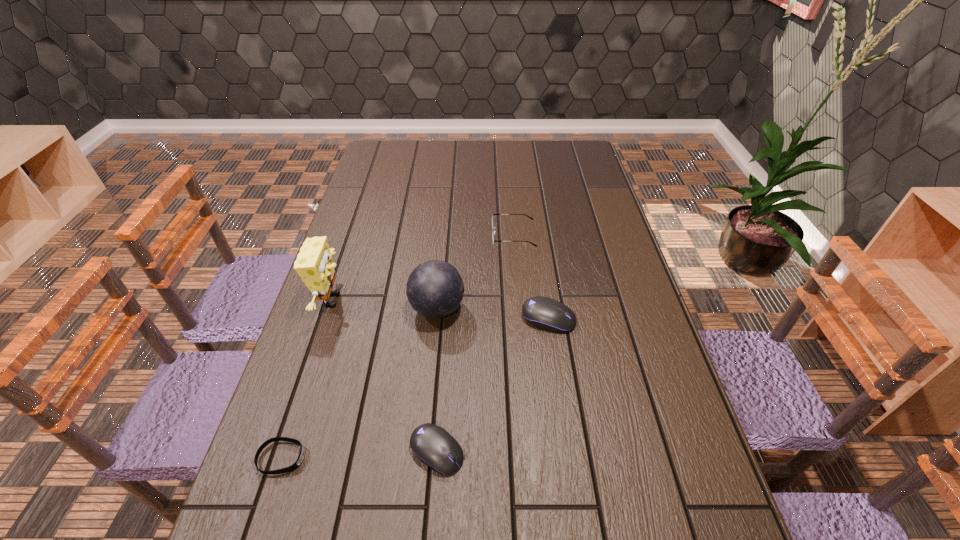
This screenshot has width=960, height=540. What are the coordinates of `free region that satisfies the following two spatial constraints: 1. on the grip area of the fifth shortest object; 2. on the right side of the shorter computer mouse` in the screenshot? It's located at (424, 451).

Find the location of `vacant area in the image that satisfies the following two spatial constraints: 1. on the grip area of the bowling ball; 2. on the left side of the farther computer mouse`. vacant area in the image that satisfies the following two spatial constraints: 1. on the grip area of the bowling ball; 2. on the left side of the farther computer mouse is located at coordinates (437, 318).

Identify the location of vacant space that satisfies the following two spatial constraints: 1. on the grip area of the bowling ball; 2. on the back side of the shorter computer mouse. This screenshot has width=960, height=540. (424, 451).

At what (x,y) coordinates should I click in order to perform the action: click on vacant region that satisfies the following two spatial constraints: 1. on the back side of the fifth tallest object; 2. on the grip area of the bowling ball. Please return your answer as a coordinate pair (x, y). Looking at the image, I should click on (447, 309).

The width and height of the screenshot is (960, 540). Identify the location of free space that satisfies the following two spatial constraints: 1. on the grip area of the second tallest object; 2. on the back side of the shorter computer mouse. pos(424,451).

Locate an element on the screen. vacant space that satisfies the following two spatial constraints: 1. on the back side of the left computer mouse; 2. on the face of the sponge is located at coordinates (447, 300).